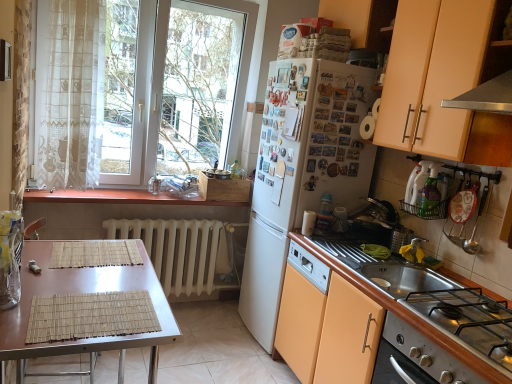
Question: Looking at the image, does white glass window at upper left seem bigger or smaller compared to clear glass jar at left?

Choices:
 (A) big
 (B) small

Answer: (A)

Question: From a real-world perspective, is white glass window at upper left positioned above or below clear glass jar at left?

Choices:
 (A) below
 (B) above

Answer: (B)

Question: Based on their relative distances, which object is nearer to the white glossy cup at upper center, which is counted as the 1th appliance, starting from the left?

Choices:
 (A) brown bamboo placemat at lower left
 (B) white glass window at upper left
 (C) matte peach cabinet at upper right, acting as the 2th cabinetry starting from the bottom
 (D) white matte refrigerator at center
 (E) white plastic dish rack at right, which ranks as the first appliance in top-to-bottom order

Answer: (D)

Question: Considering the real-world distances, which object is farthest from the matte peach cabinet at upper right, acting as the 2th cabinetry starting from the bottom?

Choices:
 (A) sheer white curtain at left
 (B) clear glass jar at left
 (C) white plastic dish rack at right, which is counted as the 1th appliance, starting from the front
 (D) white metallic radiator at center
 (E) wooden at left

Answer: (B)